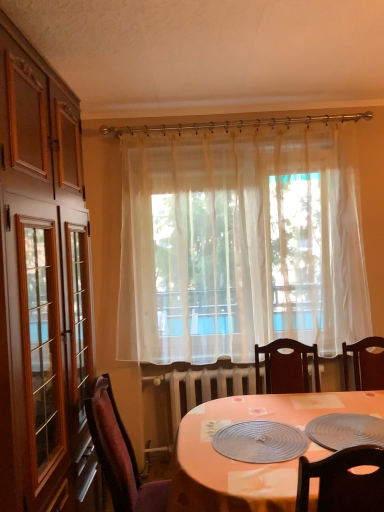
The height and width of the screenshot is (512, 384). What are the coordinates of `vacant space underneath metallic textured platter at center, which is the 2th platter from right to left (from a real-world perspective)` in the screenshot? It's located at (255, 438).